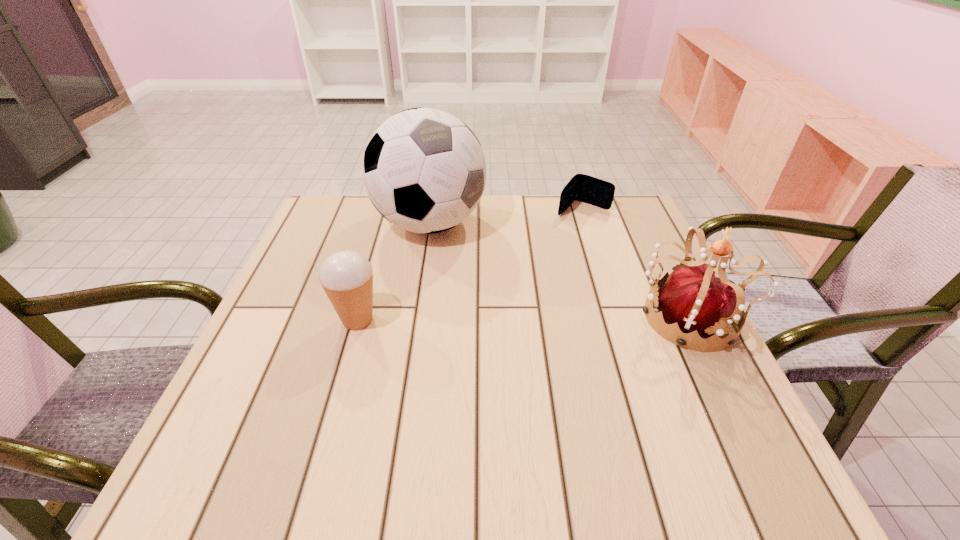
The height and width of the screenshot is (540, 960). In order to click on free spot at the far left corner of the desktop in this screenshot , I will do `click(322, 225)`.

You are a GUI agent. You are given a task and a screenshot of the screen. Output one action in this format:
    pyautogui.click(x=<x>, y=<y>)
    Task: Click on the free location at the near left corner
    
    Given the screenshot: What is the action you would take?
    pyautogui.click(x=286, y=418)

Find the location of `free space at the far right corner of the desktop`. free space at the far right corner of the desktop is located at coordinates (600, 230).

In the image, there is a desktop. In order to click on free space at the near right corner in this screenshot , I will do `click(684, 427)`.

The height and width of the screenshot is (540, 960). I want to click on blank region between the tallest object and the wallet, so click(506, 216).

Locate an element on the screen. free spot between the wallet and the icecream is located at coordinates (470, 264).

Where is `vacant area that lies between the tallest object and the third shortest object`? The image size is (960, 540). vacant area that lies between the tallest object and the third shortest object is located at coordinates (558, 271).

This screenshot has height=540, width=960. Identify the location of free space between the wallet and the soccer ball. (506, 216).

Find the location of a particular element. free space between the wallet and the second tallest object is located at coordinates (635, 264).

Locate an element on the screen. unoccupied area between the shortest object and the second shortest object is located at coordinates (470, 264).